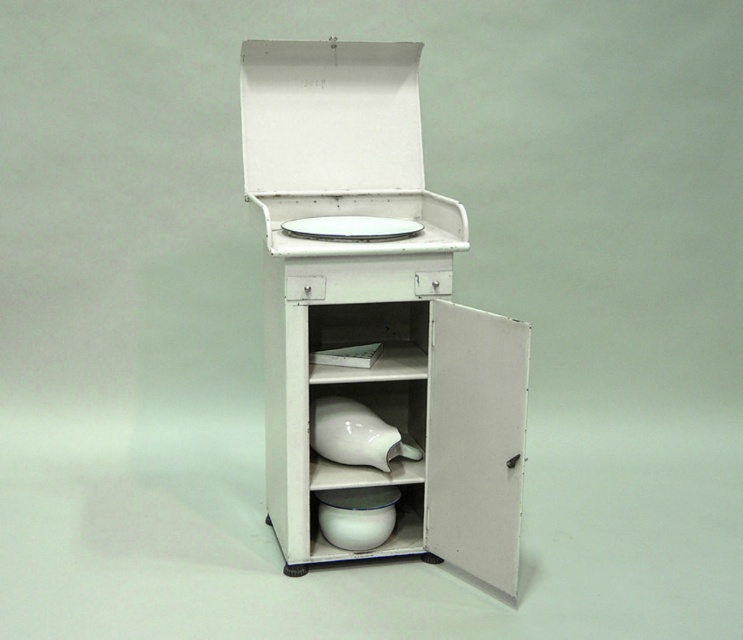
Question: Is white glossy vase at center to the right of white glossy plate at upper center from the viewer's perspective?

Choices:
 (A) no
 (B) yes

Answer: (A)

Question: Observing the image, what is the correct spatial positioning of white glossy vase at center in reference to white glossy plate at upper center?

Choices:
 (A) right
 (B) left

Answer: (B)

Question: Which object appears closest to the camera in this image?

Choices:
 (A) white glossy vase at center
 (B) white glossy plate at upper center

Answer: (B)

Question: Can you confirm if white glossy vase at center is positioned to the right of white glossy plate at upper center?

Choices:
 (A) yes
 (B) no

Answer: (B)